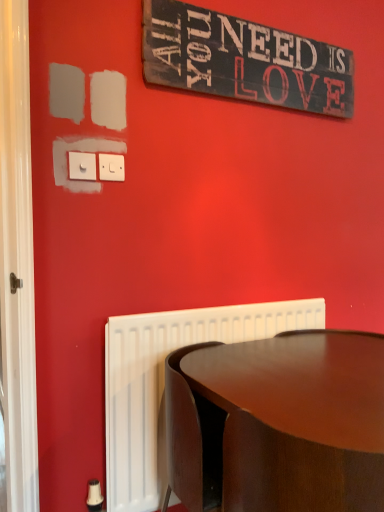
Question: Is white plastic switch at upper left, acting as the 2th electric outlet starting from the back, not close to rustic wood signboard at upper center?

Choices:
 (A) yes
 (B) no

Answer: (B)

Question: Is white plastic switch at upper left, acting as the 2th electric outlet starting from the back, thinner than rustic wood signboard at upper center?

Choices:
 (A) no
 (B) yes

Answer: (B)

Question: From a real-world perspective, is white plastic switch at upper left, placed as the first electric outlet when sorted from left to right, physically below rustic wood signboard at upper center?

Choices:
 (A) no
 (B) yes

Answer: (B)

Question: Is white plastic switch at upper left, arranged as the first electric outlet when viewed from the front, positioned with its back to rustic wood signboard at upper center?

Choices:
 (A) yes
 (B) no

Answer: (B)

Question: Does white plastic switch at upper left, acting as the 2th electric outlet starting from the back, appear on the right side of rustic wood signboard at upper center?

Choices:
 (A) yes
 (B) no

Answer: (B)

Question: From a real-world perspective, is white plastic switch at upper left, arranged as the first electric outlet when viewed from the front, on top of rustic wood signboard at upper center?

Choices:
 (A) yes
 (B) no

Answer: (B)

Question: Is glossy wood table at lower right facing towards rustic wood signboard at upper center?

Choices:
 (A) no
 (B) yes

Answer: (A)

Question: Considering the relative sizes of glossy wood table at lower right and rustic wood signboard at upper center in the image provided, is glossy wood table at lower right smaller than rustic wood signboard at upper center?

Choices:
 (A) no
 (B) yes

Answer: (A)

Question: Is glossy wood table at lower right shorter than rustic wood signboard at upper center?

Choices:
 (A) yes
 (B) no

Answer: (B)

Question: From the image's perspective, does glossy wood table at lower right appear higher than rustic wood signboard at upper center?

Choices:
 (A) no
 (B) yes

Answer: (A)

Question: Is glossy wood table at lower right looking in the opposite direction of rustic wood signboard at upper center?

Choices:
 (A) no
 (B) yes

Answer: (A)

Question: Is glossy wood table at lower right bigger than rustic wood signboard at upper center?

Choices:
 (A) no
 (B) yes

Answer: (B)

Question: Is glossy wood table at lower right bigger than white plastic switch at upper left, the second electric outlet when ordered from front to back?

Choices:
 (A) yes
 (B) no

Answer: (A)